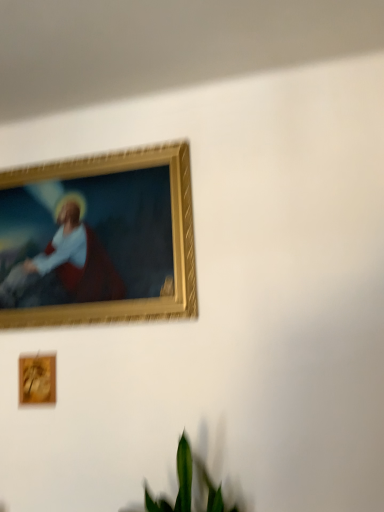
Question: Choose the correct answer: Is green leafy plant at lower center inside wooden frame at lower left, the 2th picture frame positioned from the top, or outside it?

Choices:
 (A) outside
 (B) inside

Answer: (A)

Question: Would you say green leafy plant at lower center is to the left or to the right of wooden frame at lower left, which is counted as the first picture frame, starting from the bottom, in the picture?

Choices:
 (A) right
 (B) left

Answer: (A)

Question: Estimate the real-world distances between objects in this image. Which object is farther from the green leafy plant at lower center?

Choices:
 (A) gold-framed painting at upper left, arranged as the 2th picture frame when ordered from the bottom
 (B) wooden frame at lower left, which is counted as the first picture frame, starting from the bottom

Answer: (A)

Question: Which object is positioned closest to the gold-framed painting at upper left, the first picture frame from the top?

Choices:
 (A) green leafy plant at lower center
 (B) wooden frame at lower left, the 2th picture frame positioned from the top

Answer: (B)